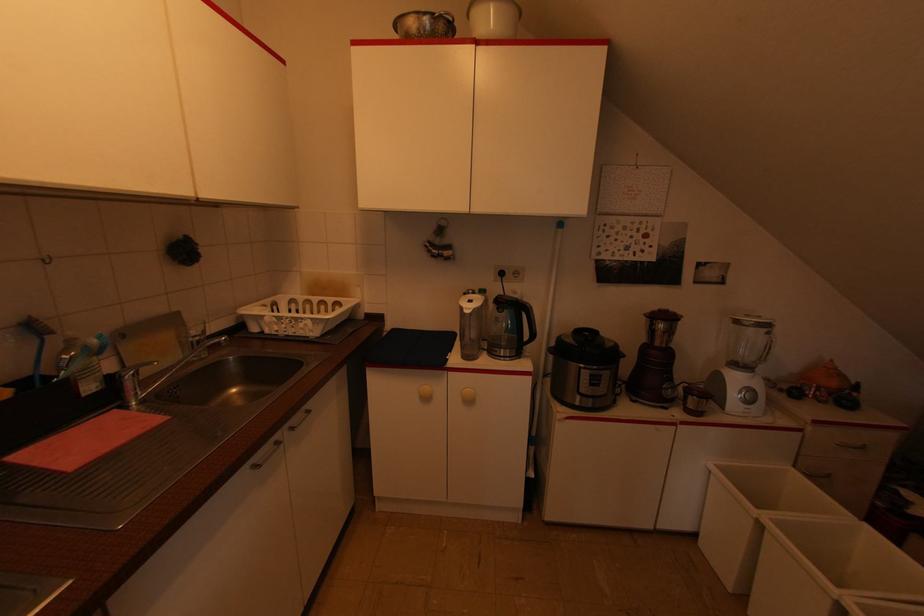
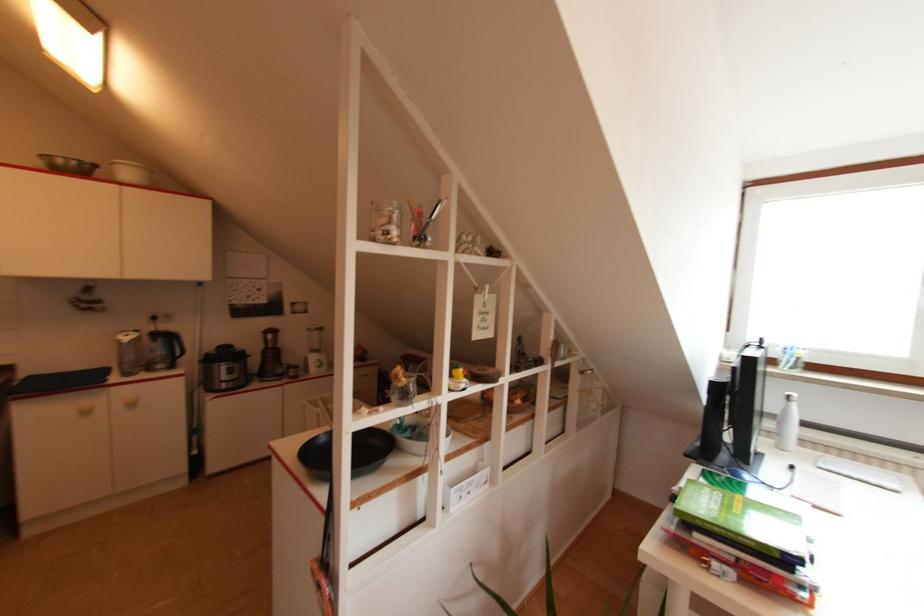
Where in the second image is the point corresponding to the point at 469,402 from the first image?

(134, 405)